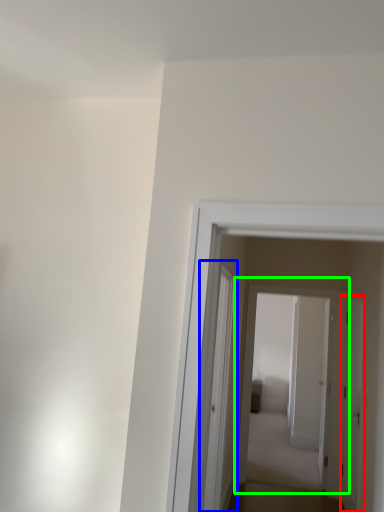
Question: Which is nearer to the door (highlighted by a red box)? glass door (highlighted by a blue box) or door (highlighted by a green box).

Choices:
 (A) glass door
 (B) door

Answer: (B)